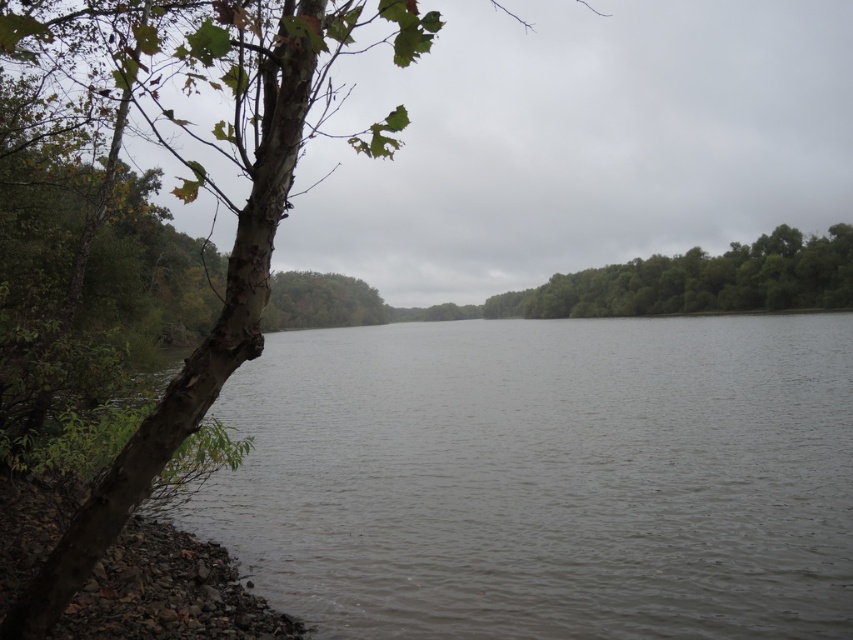
Who is more distant from viewer, (28, 536) or (724, 260)?

The point (724, 260) is more distant.

Can you confirm if rocks at lower left is smaller than green leafy trees at center?

Indeed, rocks at lower left has a smaller size compared to green leafy trees at center.

You are a GUI agent. You are given a task and a screenshot of the screen. Output one action in this format:
    pyautogui.click(x=<x>, y=<y>)
    Task: Click on the rocks at lower left
    
    Given the screenshot: What is the action you would take?
    pyautogui.click(x=167, y=593)

Who is taller, green rough bark tree at left or rocks at lower left?

Standing taller between the two is green rough bark tree at left.

Does green rough bark tree at left have a lesser height compared to rocks at lower left?

No.

What do you see at coordinates (227, 209) in the screenshot?
I see `green rough bark tree at left` at bounding box center [227, 209].

Locate an element on the screen. green rough bark tree at left is located at coordinates (227, 209).

Between point (228, 4) and point (761, 237), which one is positioned in front?

Positioned in front is point (228, 4).

Is green rough bark tree at left to the right of green leafy trees at center from the viewer's perspective?

No, green rough bark tree at left is not to the right of green leafy trees at center.

Between point (136, 49) and point (625, 268), which one is positioned behind?

Positioned behind is point (625, 268).

I want to click on green rough bark tree at left, so click(x=227, y=209).